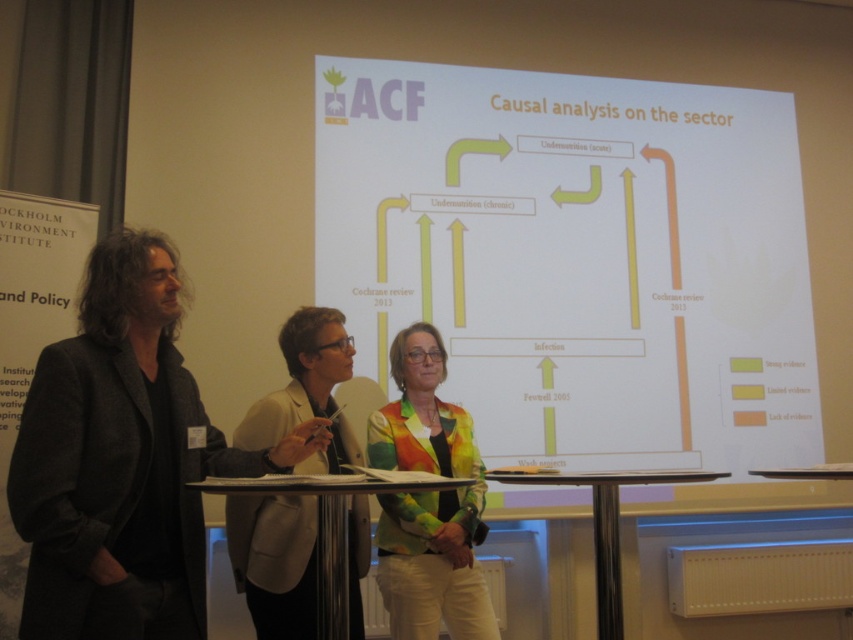
You are organizing a presentation and need to arrange chairs for attendees. The dark gray woolen jacket at left and rainbow fabric jacket at center are standing in the way. Which jacket should you move to make more space for the chairs?

The dark gray woolen jacket at left might be wider than rainbow fabric jacket at center, so moving the dark gray woolen jacket at left would create more space for the chairs.

You are a guest speaker at the presentation. You need to place your notes on the metallic polished table at center without walking around the rainbow fabric jacket at center. Is this possible?

The metallic polished table at center is behind the rainbow fabric jacket at center, so you can reach the metallic polished table at center by moving behind the rainbow fabric jacket at center without needing to walk around it.

You are a presenter who needs to move to the front of the room to adjust the projection screen. The rainbow fabric jacket at center and the metallic silver table at center are in your path. Which object do you need to move around first?

You need to move around the rainbow fabric jacket at center first because the metallic silver table at center is behind it, meaning the jacket is closer to your path.